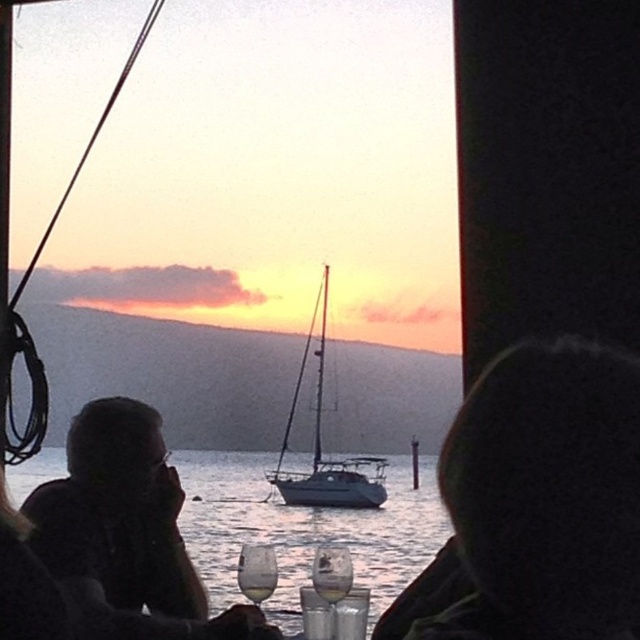
Question: Which is nearer to the clear glass wine at lower center?

Choices:
 (A) clear glass wine at center
 (B) white matte sailboat at center

Answer: (A)

Question: Is clear glass wine glass at center further to camera compared to clear glass wine at center?

Choices:
 (A) no
 (B) yes

Answer: (B)

Question: Which object is positioned closest to the silhouette hair at center?

Choices:
 (A) matte black hair at upper left
 (B) white matte sailboat at center

Answer: (A)

Question: Which of these objects is positioned closest to the clear glass wine at lower center?

Choices:
 (A) clear water at center
 (B) clear glass wine glass at center

Answer: (B)

Question: Can you confirm if clear glass wine at lower center is wider than clear glass wine at center?

Choices:
 (A) yes
 (B) no

Answer: (A)

Question: Can you confirm if clear glass wine glass at lower center is wider than clear glass wine at lower center?

Choices:
 (A) yes
 (B) no

Answer: (B)